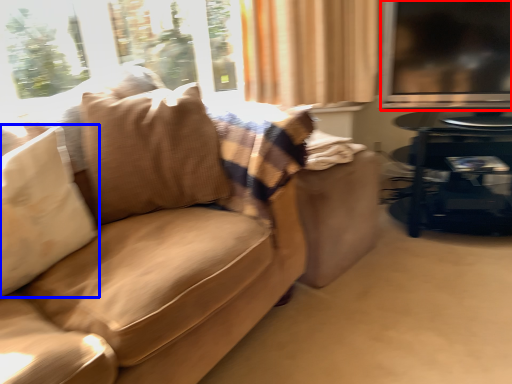
Question: Which point is closer to the camera, window screen (highlighted by a red box) or pillow (highlighted by a blue box)?

Choices:
 (A) window screen
 (B) pillow

Answer: (B)